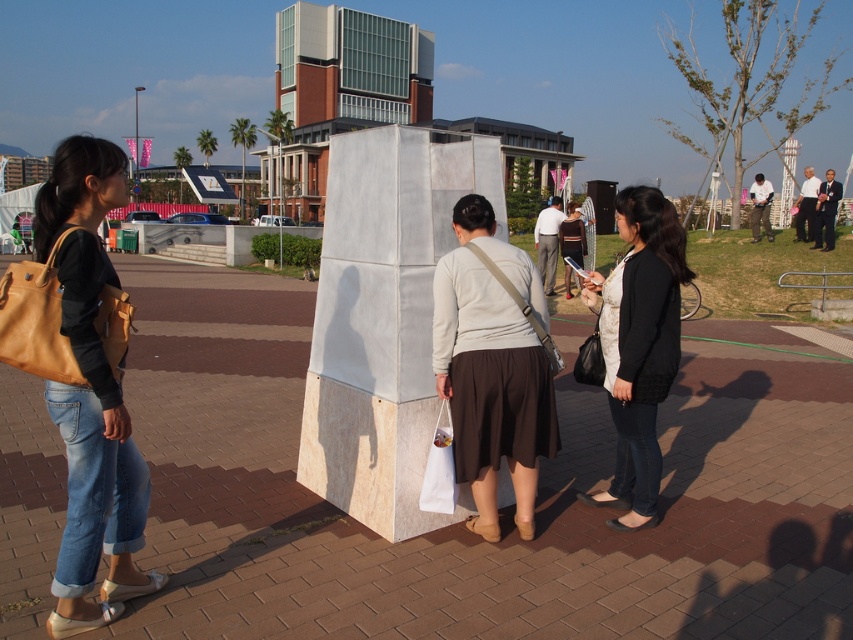
You are standing at the point labeled point (125, 480) and want to walk to the point labeled point (483, 349). Which direction should you move to get closer to your destination?

You should move backward because point (125, 480) is in front of point (483, 349), meaning your current position is closer to the viewer and you need to move away from the viewer to reach the destination.

You are a photographer trying to capture a clear shot of the matte beige sweater at center and the black matte jacket at center. Since you want both subjects to be visible, which one should you adjust your camera focus to prioritize so that the other remains in the background?

You should focus on the matte beige sweater at center because it is in front of the black matte jacket at center, so keeping it in focus will naturally place the black matte jacket at center in the background.